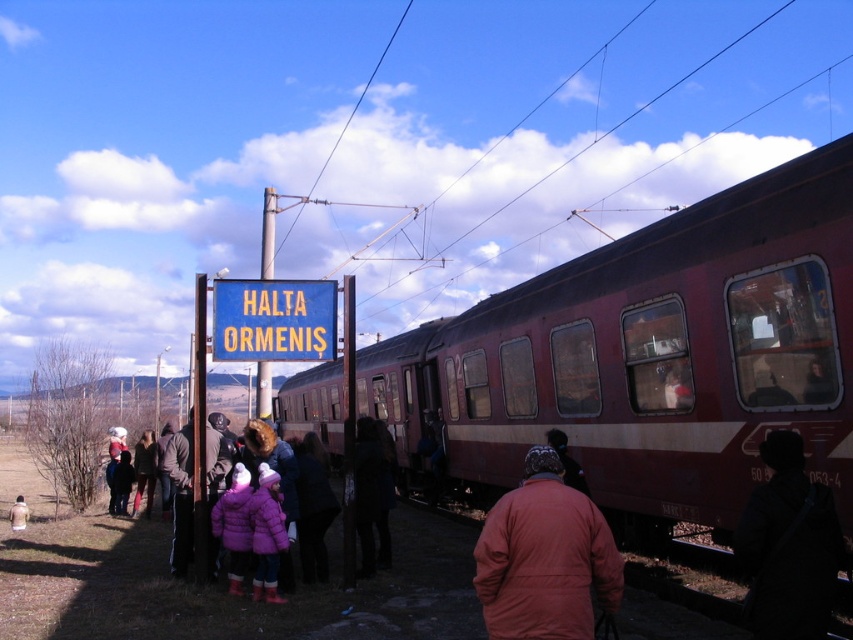
Which is behind, point (802, 236) or point (527, 595)?

Point (802, 236)

Between maroon metallic train at center and orange matte jacket at center, which one appears on the left side from the viewer's perspective?

Answer: maroon metallic train at center is more to the left.

Does point (590, 376) come closer to viewer compared to point (512, 538)?

No, (590, 376) is further to viewer.

You are a GUI agent. You are given a task and a screenshot of the screen. Output one action in this format:
    pyautogui.click(x=<x>, y=<y>)
    Task: Click on the maroon metallic train at center
    Image resolution: width=853 pixels, height=640 pixels.
    Given the screenshot: What is the action you would take?
    pyautogui.click(x=651, y=358)